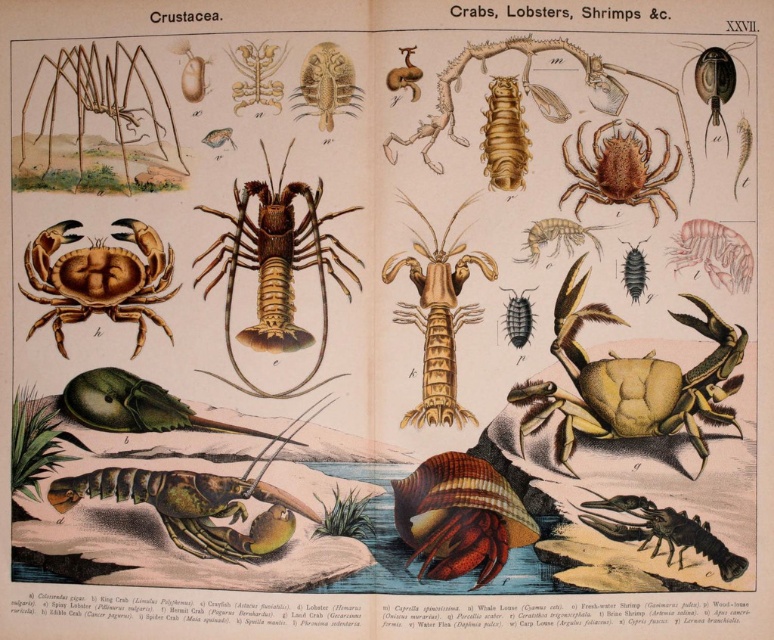
Is matte brown crab at center smaller than shiny brown lobster at center?

Yes, matte brown crab at center is smaller than shiny brown lobster at center.

In the scene shown: Who is more distant from viewer, (63,234) or (687,544)?

The point (63,234) is more distant.

Who is more forward, (40, 273) or (682, 528)?

Point (682, 528) is more forward.

Identify the location of matte brown crab at center. (98, 278).

Can you confirm if shiny brown hermit crab at center is shorter than matte brown crab at center?

Yes.

Who is shorter, shiny brown hermit crab at center or matte brown crab at center?

shiny brown hermit crab at center is shorter.

Find the location of a particular element. shiny brown hermit crab at center is located at coordinates (459, 516).

The image size is (774, 640). Identify the location of shiny brown hermit crab at center. (459, 516).

Between brown matte lobster at center and brown matte spider at upper center, which one has less height?

brown matte spider at upper center is shorter.

Does brown matte lobster at center come behind brown matte spider at upper center?

Yes, it is.

Does point (225, 257) lie behind point (401, 140)?

Yes, point (225, 257) is behind point (401, 140).

Identify the location of brown matte lobster at center. This screenshot has height=640, width=774. (276, 268).